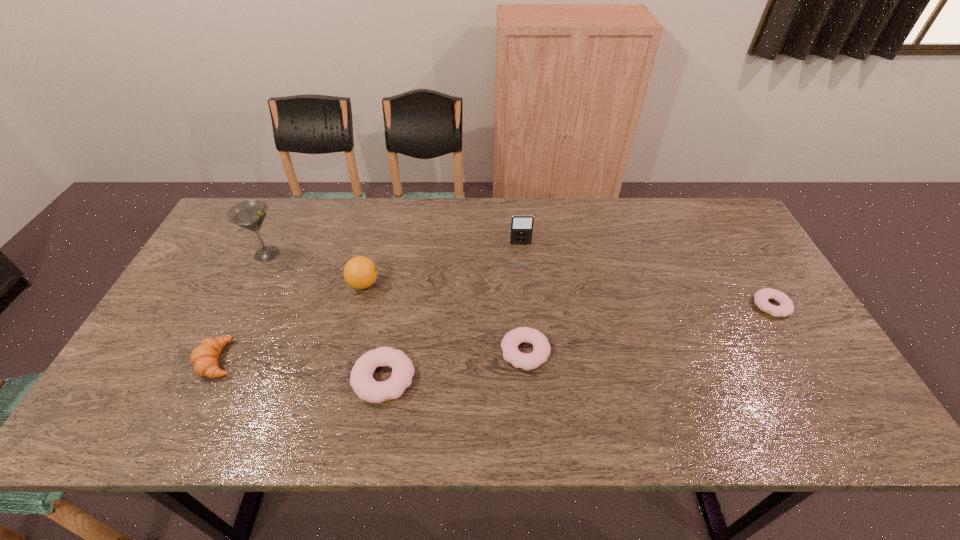
Identify the location of martini situated at the left edge. (250, 214).

You are a GUI agent. You are given a task and a screenshot of the screen. Output one action in this format:
    pyautogui.click(x=<x>, y=<y>)
    Task: Click on the crescent roll situated at the left edge
    The image size is (960, 540).
    Given the screenshot: What is the action you would take?
    204,358

Locate an element on the screen. object present at the right edge is located at coordinates (786, 307).

Where is `object present at the far left corner`? The width and height of the screenshot is (960, 540). object present at the far left corner is located at coordinates (250, 214).

This screenshot has height=540, width=960. What are the coordinates of `object present at the near left corner` in the screenshot? It's located at (204, 358).

The width and height of the screenshot is (960, 540). I want to click on free space at the far edge, so click(520, 211).

Where is `vacant region at the near edge of the desktop`? vacant region at the near edge of the desktop is located at coordinates (745, 390).

Locate an element on the screen. Image resolution: width=960 pixels, height=540 pixels. vacant space at the left edge of the desktop is located at coordinates (209, 317).

Locate an element on the screen. vacant region at the right edge of the desktop is located at coordinates (749, 251).

Locate an element on the screen. Image resolution: width=960 pixels, height=540 pixels. free space at the far left corner of the desktop is located at coordinates (234, 244).